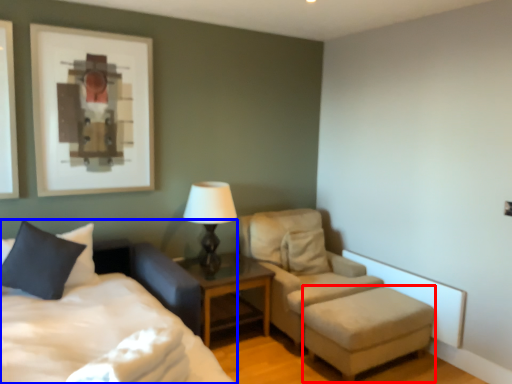
Question: Which object appears farthest to the camera in this image, stool (highlighted by a red box) or bed (highlighted by a blue box)?

Choices:
 (A) stool
 (B) bed

Answer: (A)